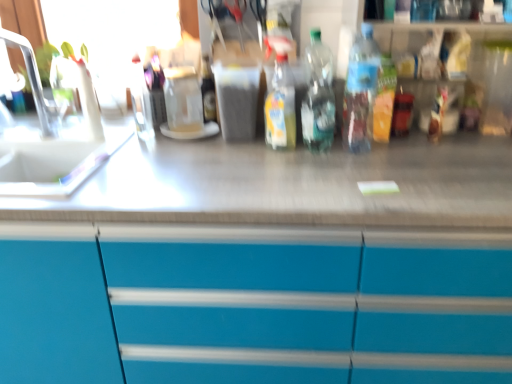
The image size is (512, 384). I want to click on empty space that is to the right of white plastic faucet at left, so click(102, 144).